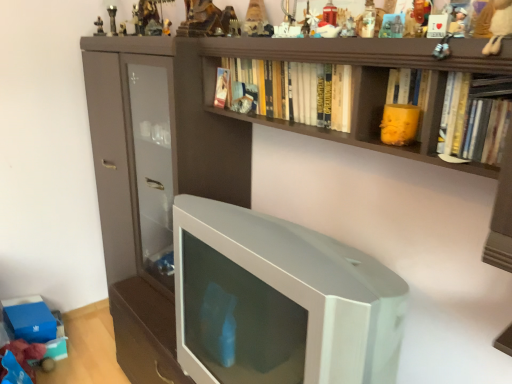
Image resolution: width=512 pixels, height=384 pixels. Describe the element at coordinates (293, 91) in the screenshot. I see `hardcover book at upper center, which is the 2th book in right-to-left order` at that location.

This screenshot has width=512, height=384. What do you see at coordinates (280, 301) in the screenshot? I see `white glossy television at center` at bounding box center [280, 301].

Locate an element on the screen. This screenshot has height=384, width=512. metallic gold figurine at upper center, the third toy in the left-to-right sequence is located at coordinates (166, 27).

What do you see at coordinates (349, 28) in the screenshot? The height and width of the screenshot is (384, 512). I see `metallic silver figurine at upper center, the eighth toy when ordered from left to right` at bounding box center [349, 28].

Locate an element on the screen. The width and height of the screenshot is (512, 384). white plastic windmill at upper center, the sixth toy positioned from the left is located at coordinates (309, 24).

Where is `hardcover book at upper center, which is the 2th book in right-to-left order`? hardcover book at upper center, which is the 2th book in right-to-left order is located at coordinates (293, 91).

Which object is thinner, white plastic windmill at upper center, the sixth toy when ordered from back to front, or matte plastic toy at upper center, positioned as the 4th toy in back-to-front order?

white plastic windmill at upper center, the sixth toy when ordered from back to front, is thinner.

At what (x,y) coordinates should I click in order to perform the action: click on the 2nd toy positioned above the white plastic windmill at upper center, placed as the eighth toy when sorted from front to back (from the image's perspective). Please return your answer as a coordinate pair (x, y). The height and width of the screenshot is (384, 512). Looking at the image, I should click on point(257,20).

How different are the orientations of white plastic windmill at upper center, the sixth toy when ordered from back to front, and matte plastic toy at upper center, which appears as the 5th toy when viewed from the left, in degrees?

They differ by 2.99 degrees in their facing directions.

Which is behind, point (308, 5) or point (243, 29)?

Point (243, 29)

Is yellow matte cup at upper center, the eleventh toy positioned from the left, turned away from white glossy television at center?

No, white glossy television at center is not at the back of yellow matte cup at upper center, the eleventh toy positioned from the left.

Who is more distant, yellow matte cup at upper center, acting as the 11th toy starting from the back, or white glossy television at center?

yellow matte cup at upper center, acting as the 11th toy starting from the back, is further away from the camera.

Considering the relative sizes of yellow matte cup at upper center, placed as the third toy when sorted from front to back, and white glossy television at center in the image provided, is yellow matte cup at upper center, placed as the third toy when sorted from front to back, wider than white glossy television at center?

No, yellow matte cup at upper center, placed as the third toy when sorted from front to back, is not wider than white glossy television at center.

The height and width of the screenshot is (384, 512). Find the location of `television below the yellow matte cup at upper center, placed as the third toy when sorted from front to back (from a real-world perspective)`. television below the yellow matte cup at upper center, placed as the third toy when sorted from front to back (from a real-world perspective) is located at coordinates (280, 301).

Does white glossy television at center appear on the left side of metallic figurine at upper center, which is the 2th toy in left-to-right order?

Incorrect, white glossy television at center is not on the left side of metallic figurine at upper center, which is the 2th toy in left-to-right order.

From the picture: Which point is more distant from viewer, (352,265) or (122,31)?

The point (122,31) is more distant.

In terms of width, does white glossy television at center look wider or thinner when compared to metallic figurine at upper center, the second toy in the back-to-front sequence?

Considering their sizes, white glossy television at center looks broader than metallic figurine at upper center, the second toy in the back-to-front sequence.

Between matte paper book at upper center, which is counted as the 1th book, starting from the back, and metallic silver toy at upper center, placed as the 12th toy when sorted from back to front, which one appears on the left side from the viewer's perspective?

matte paper book at upper center, which is counted as the 1th book, starting from the back.

From a real-world perspective, who is located higher, matte paper book at upper center, which is counted as the 1th book, starting from the back, or metallic silver toy at upper center, which is the 4th toy from right to left?

metallic silver toy at upper center, which is the 4th toy from right to left, from a real-world perspective.

Is matte paper book at upper center, positioned as the 1th book in left-to-right order, not inside metallic silver toy at upper center, placed as the 12th toy when sorted from back to front?

That's correct, matte paper book at upper center, positioned as the 1th book in left-to-right order, is outside of metallic silver toy at upper center, placed as the 12th toy when sorted from back to front.

Is white plush toy at upper right, which is the 13th toy in back-to-front order, inside the boundaries of hardcover book at upper right, positioned as the 3th book in back-to-front order, or outside?

white plush toy at upper right, which is the 13th toy in back-to-front order, cannot be found inside hardcover book at upper right, positioned as the 3th book in back-to-front order.

Is hardcover book at upper right, the first book in the right-to-left sequence, at the back of white plush toy at upper right, which is the 13th toy from left to right?

No, white plush toy at upper right, which is the 13th toy from left to right, is not facing away from hardcover book at upper right, the first book in the right-to-left sequence.

Does white plush toy at upper right, which is the 13th toy in back-to-front order, have a lesser width compared to hardcover book at upper right, marked as the 1th book in a front-to-back arrangement?

Yes.

The width and height of the screenshot is (512, 384). Find the location of `toy in front of the hardcover book at upper right, positioned as the 3th book in back-to-front order`. toy in front of the hardcover book at upper right, positioned as the 3th book in back-to-front order is located at coordinates (499, 26).

From a real-world perspective, is matte paper book at upper center, which is counted as the 1th book, starting from the back, positioned under metallic gold figurine at upper center, the third toy in the left-to-right sequence, based on gravity?

Yes.

Between point (224, 69) and point (170, 34), which one is positioned behind?

The point (170, 34) is more distant.

Is matte paper book at upper center, which ranks as the 3th book in front-to-back order, not close to metallic gold figurine at upper center, which is the 11th toy in front-to-back order?

No.

How different are the orientations of white plush toy at upper right, the 1th toy in the right-to-left sequence, and wooden heart at upper center, the 10th toy when ordered from back to front, in degrees?

There is a 4.06-degree angle between the facing directions of white plush toy at upper right, the 1th toy in the right-to-left sequence, and wooden heart at upper center, the 10th toy when ordered from back to front.

Between white plush toy at upper right, which is the 13th toy from left to right, and wooden heart at upper center, acting as the second toy starting from the right, which one has smaller width?

wooden heart at upper center, acting as the second toy starting from the right, is thinner.

Considering the positions of point (489, 27) and point (429, 4), is point (489, 27) closer or farther from the camera than point (429, 4)?

Clearly, point (489, 27) is closer to the camera than point (429, 4).

Can you confirm if white plush toy at upper right, which is the 13th toy in back-to-front order, is smaller than wooden heart at upper center, positioned as the twelfth toy in left-to-right order?

Actually, white plush toy at upper right, which is the 13th toy in back-to-front order, might be larger than wooden heart at upper center, positioned as the twelfth toy in left-to-right order.

Locate an element on the screen. This screenshot has height=384, width=512. toy that is the 2nd one when counting backward from the white plastic windmill at upper center, placed as the eighth toy when sorted from front to back is located at coordinates (257, 20).

Locate an element on the screen. This screenshot has width=512, height=384. the 1st toy positioned above the white glossy television at center (from the image's perspective) is located at coordinates (399, 124).

From the image, which object appears to be nearer to translucent glass figurine at upper center, the 5th toy viewed from the front, metallic gold statue at upper center, which is counted as the 4th toy, starting from the left, or hardcover book at upper right, the first book in the right-to-left sequence?

hardcover book at upper right, the first book in the right-to-left sequence, lies closer to translucent glass figurine at upper center, the 5th toy viewed from the front, than the other object.

When comparing their distances from white plastic windmill at upper center, arranged as the 8th toy when viewed from the right, does metallic figurine at upper center, the second toy in the back-to-front sequence, or metallic silver figurine at upper center, which is the 6th toy from right to left, seem closer?

metallic silver figurine at upper center, which is the 6th toy from right to left.

When comparing their distances from matte plastic toy at upper center, marked as the 10th toy in a front-to-back arrangement, does metallic chess piece at upper center, the thirteenth toy in the right-to-left sequence, or white plush toy at upper right, which is the 13th toy from left to right, seem closer?

white plush toy at upper right, which is the 13th toy from left to right.

Considering their positions, is white plush toy at upper right, the 1th toy in the right-to-left sequence, positioned closer to metallic gold statue at upper center, the ninth toy when ordered from front to back, than hardcover book at upper center, the second book from the back?

hardcover book at upper center, the second book from the back, is positioned closer to the anchor metallic gold statue at upper center, the ninth toy when ordered from front to back.

Looking at the image, which one is located closer to white plastic windmill at upper center, arranged as the 8th toy when viewed from the right, translucent glass figurine at upper center, which appears as the 9th toy when viewed from the back, or yellow matte cup at upper center, placed as the third toy when sorted from front to back?

Based on the image, translucent glass figurine at upper center, which appears as the 9th toy when viewed from the back, appears to be nearer to white plastic windmill at upper center, arranged as the 8th toy when viewed from the right.

From the image, which object appears to be farther from white glossy television at center, metallic chess piece at upper center, the 13th toy from the front, or matte paper book at upper center, which ranks as the 3th book in front-to-back order?

metallic chess piece at upper center, the 13th toy from the front, is positioned further to the anchor white glossy television at center.

Based on their spatial positions, is metallic gold figurine at upper center, the 3th toy when ordered from back to front, or hardcover book at upper center, acting as the 2th book starting from the left, closer to matte plastic toy at upper center, positioned as the 4th toy in back-to-front order?

hardcover book at upper center, acting as the 2th book starting from the left.

Looking at this image, considering their positions, is white plush toy at upper right, which is the 13th toy in back-to-front order, positioned further to translucent glass figurine at upper center, the ninth toy in the left-to-right sequence, than hardcover book at upper center, the second book from the back?

white plush toy at upper right, which is the 13th toy in back-to-front order, is further to translucent glass figurine at upper center, the ninth toy in the left-to-right sequence.

Locate an element on the screen. The image size is (512, 384). book positioned between translucent glass figurine at upper center, which is counted as the 5th toy, starting from the right, and matte paper book at upper center, which is counted as the 1th book, starting from the back, from near to far is located at coordinates (293, 91).

The image size is (512, 384). Identify the location of toy between metallic gold figurine at upper center, which is the 11th toy in front-to-back order, and metallic chess piece at upper center, the first toy when ordered from back to front, from front to back. (122, 29).

Where is `book between translucent glass figurine at upper center, the ninth toy in the left-to-right sequence, and matte plastic toy at upper center, which appears as the 5th toy when viewed from the left, along the z-axis`? book between translucent glass figurine at upper center, the ninth toy in the left-to-right sequence, and matte plastic toy at upper center, which appears as the 5th toy when viewed from the left, along the z-axis is located at coordinates (293, 91).

Locate an element on the screen. This screenshot has width=512, height=384. book between metallic figurine at upper center, which is the 2th toy in left-to-right order, and matte plastic toy at upper center, the 9th toy viewed from the right is located at coordinates (222, 88).